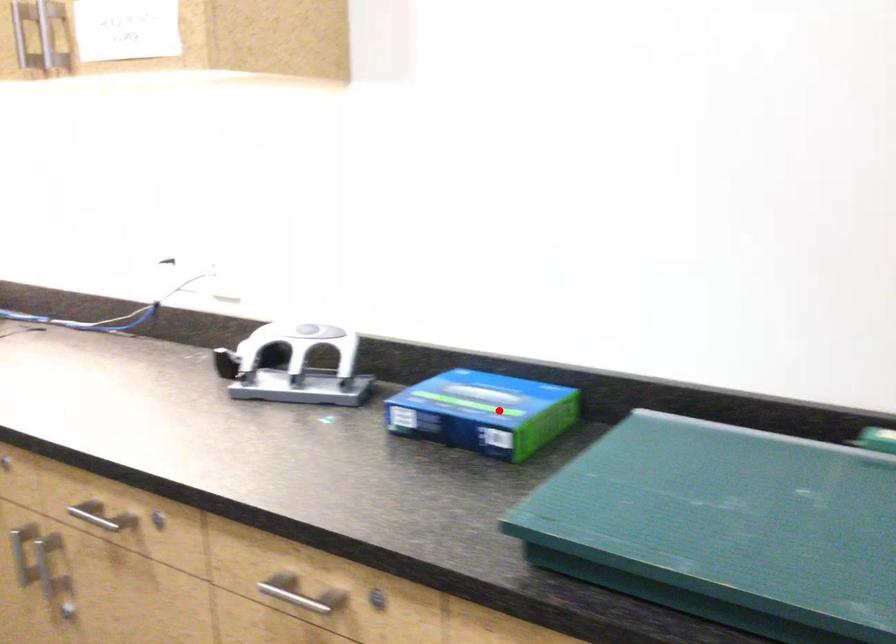
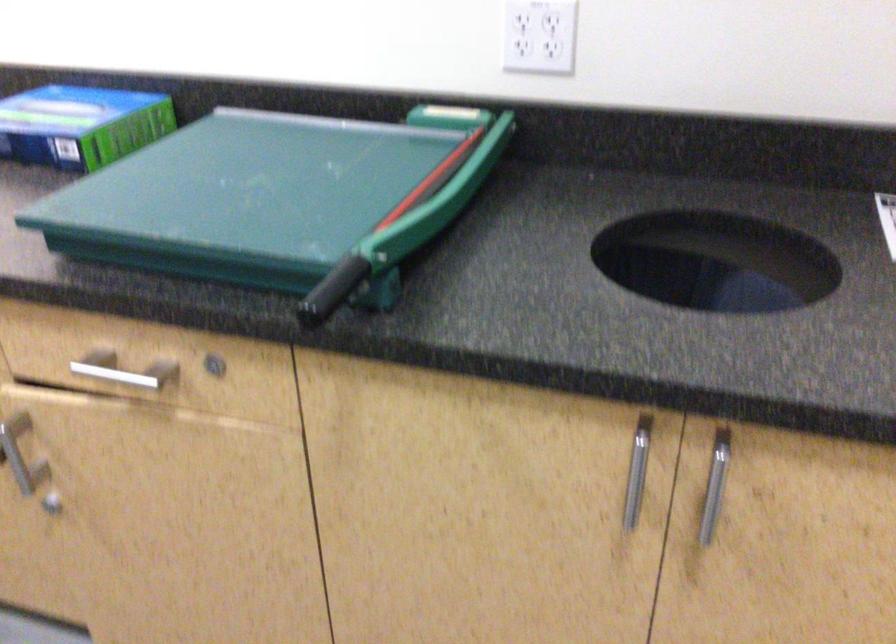
The point at the highlighted location is marked in the first image. Where is the corresponding point in the second image?

(81, 125)